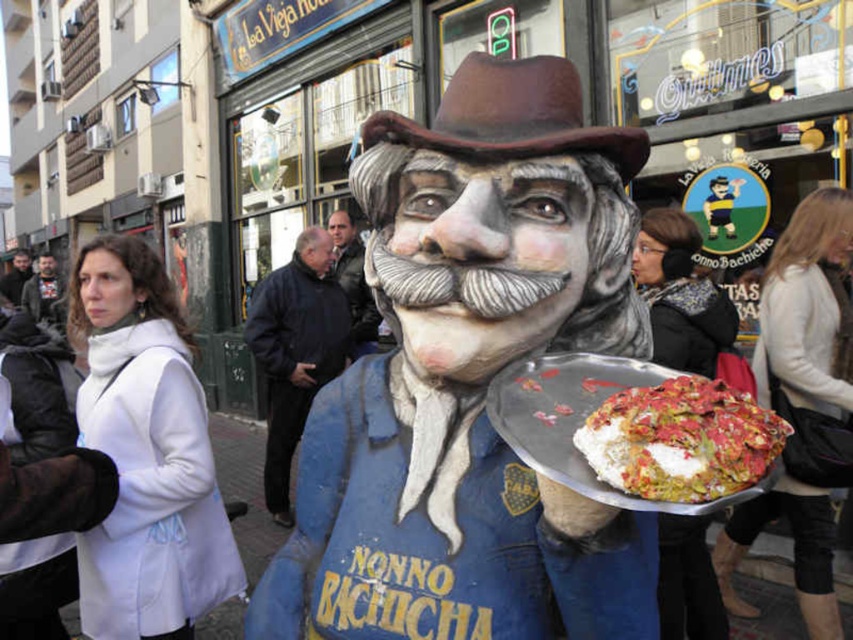
How much distance is there between dark blue jacket at center and dark brown leather jacket at center?

8.64 meters

This screenshot has height=640, width=853. I want to click on dark blue jacket at center, so [294, 352].

This screenshot has width=853, height=640. Identify the location of dark blue jacket at center. (294, 352).

Between white sweater at center and white creamy pizza at center, which one appears on the right side from the viewer's perspective?

From the viewer's perspective, white sweater at center appears more on the right side.

Is white sweater at center to the left of white creamy pizza at center from the viewer's perspective?

No, white sweater at center is not to the left of white creamy pizza at center.

At what (x,y) coordinates should I click in order to perform the action: click on white sweater at center. Please return your answer as a coordinate pair (x, y). Looking at the image, I should click on (804, 403).

Is black leather jacket at center bigger than dark gray fabric jacket at left?

No.

Between black leather jacket at center and dark gray fabric jacket at left, which one has more height?

dark gray fabric jacket at left

The image size is (853, 640). Describe the element at coordinates (680, 294) in the screenshot. I see `black leather jacket at center` at that location.

You are a GUI agent. You are given a task and a screenshot of the screen. Output one action in this format:
    pyautogui.click(x=<x>, y=<y>)
    Task: Click on the black leather jacket at center
    The image size is (853, 640).
    Given the screenshot: What is the action you would take?
    pyautogui.click(x=680, y=294)